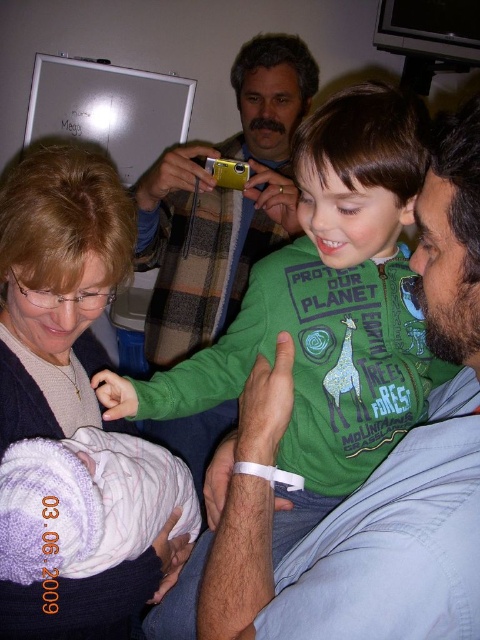
You are a photographer trying to capture a closeup of the white swaddled baby at lower left without including the matte gray sweater at upper left in the frame. Given their sizes, is this feasible?

The matte gray sweater at upper left is wider than the white swaddled baby at lower left, so it might block the view. Adjust your angle or position to ensure the sweater isn

You are a nurse in the hospital room. You need to place a medical chart on the desk. The desk is located at the point with coordinates (325,310). Where should you place the medical chart?

The medical chart should be placed on the desk located at the point with coordinates (325,310).

You are a photographer in the hospital room and want to capture a photo of the white swaddled baby at lower left without including the matte gray sweater at upper left in the frame. Is it possible to position yourself in a way that the sweater is out of the shot while keeping the baby centered?

Yes, since the matte gray sweater at upper left is to the left of the white swaddled baby at lower left, you can position yourself slightly to the right of the baby so that the sweater is out of the frame while keeping the baby centered.